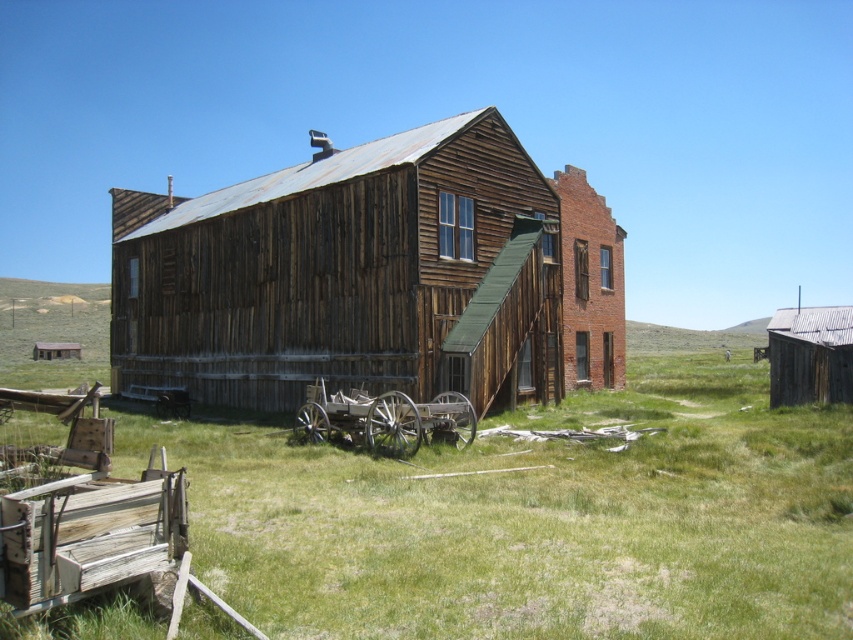
You are standing in front of the weathered wood building at center and the rustic wood wagon at center. Which object is positioned higher relative to the other?

The weathered wood building at center is above the rustic wood wagon at center, so it is positioned higher.

You are standing at the camera position looking at the rustic wooden building. There is a point marked at coordinates point (393,426). Can you reach this point by walking straight ahead without moving sideways?

The point (393,426) is 15.51 meters away from the camera. Since it is a straight distance, you can walk straight ahead to reach it without moving sideways.

You are standing in front of the rustic wood wagon at center and want to walk to the rusty corrugated tin hut at right. Which direction should you go?

You should walk to the right because the rustic wood wagon at center is to the left of the rusty corrugated tin hut at right.